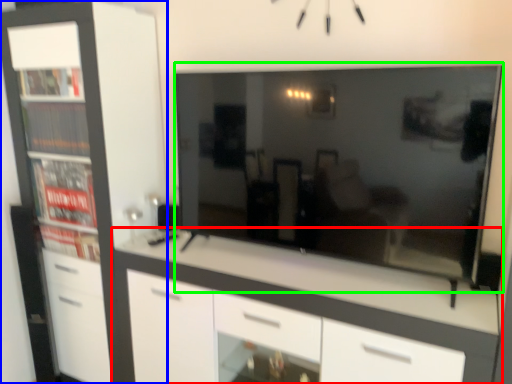
Question: Estimate the real-world distances between objects in this image. Which object is farther from chest of drawers (highlighted by a red box), cabinetry (highlighted by a blue box) or television (highlighted by a green box)?

Choices:
 (A) cabinetry
 (B) television

Answer: (A)